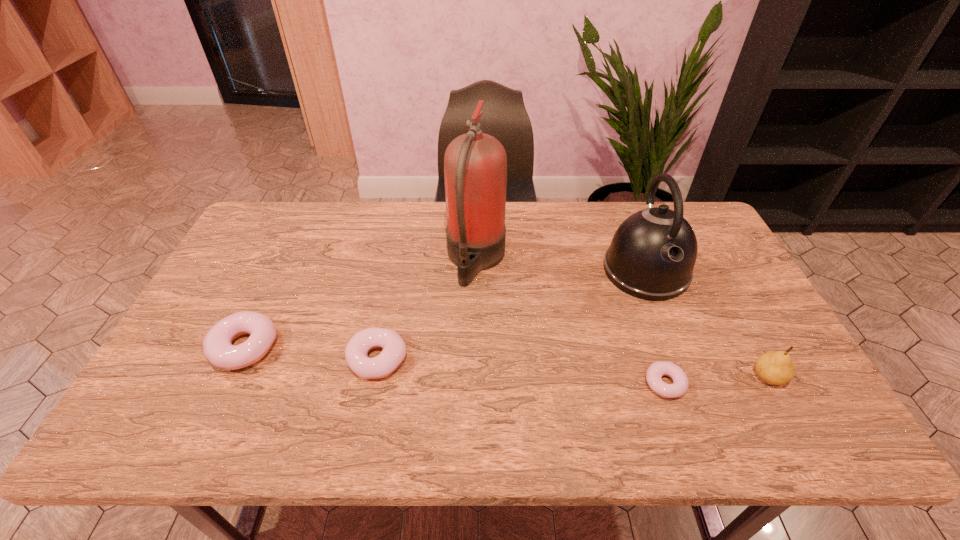
This screenshot has height=540, width=960. Identify the location of spot to insert another doughnut for uniform distribution. (518, 371).